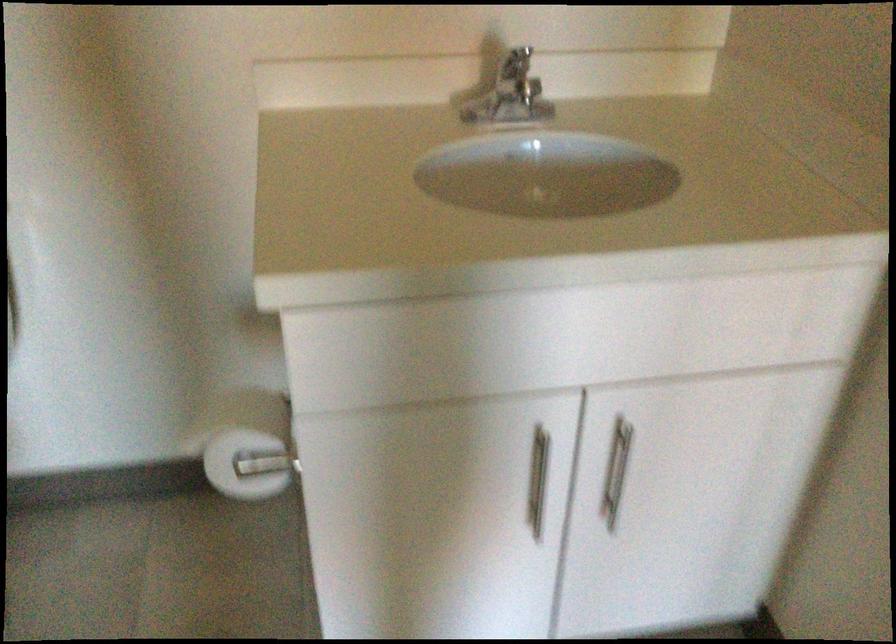
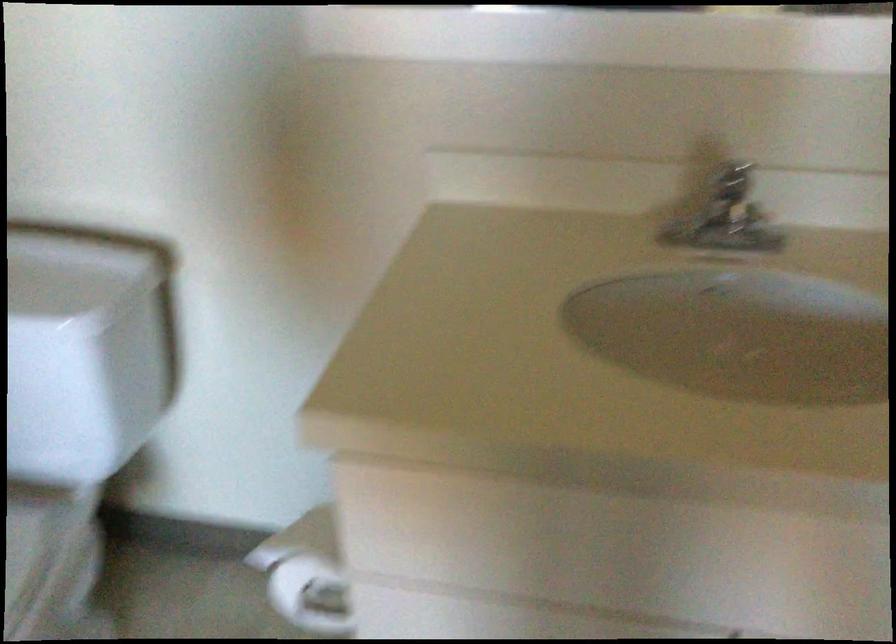
What movement of the cameraman would produce the second image?

The movement direction of the cameraman is right, forward.